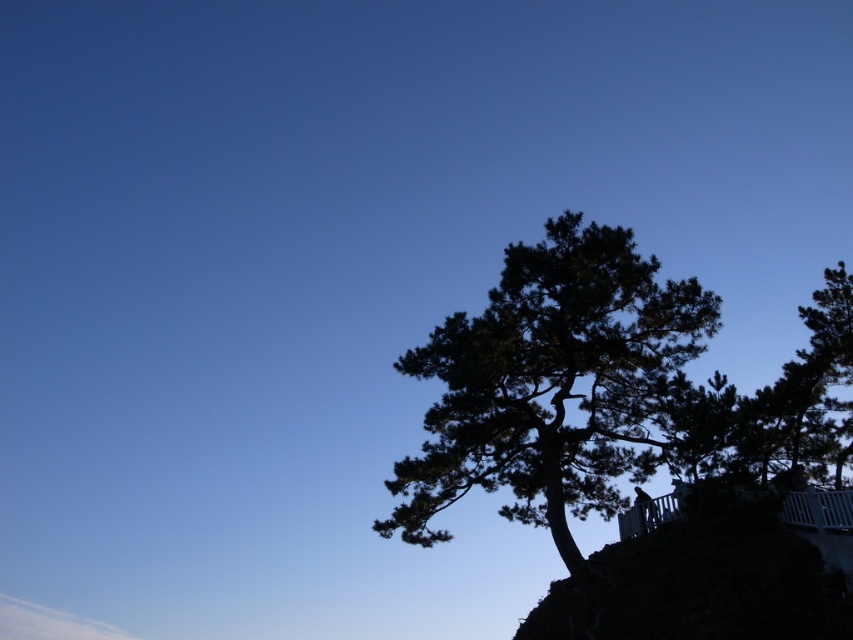
You are standing at point (549, 381) in the scene. What object is located exactly at your current position?

The dark green textured tree at center is located exactly at point (549, 381).

Looking at this image, you are standing in the outdoor scene and want to take a photo of the dark green textured tree at center and the dark green textured tree at upper right. Which tree is positioned lower in the frame?

The dark green textured tree at center is positioned lower in the frame than the dark green textured tree at upper right.